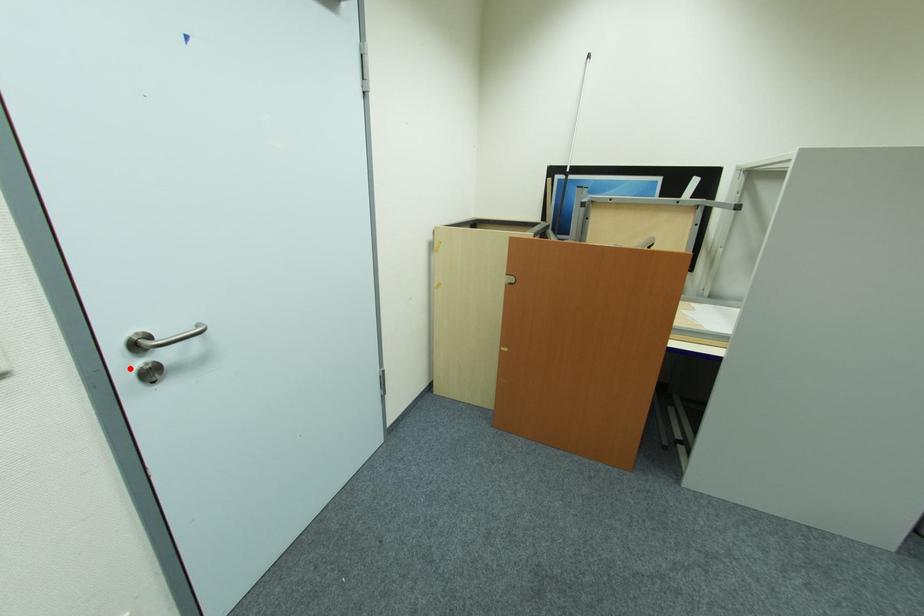
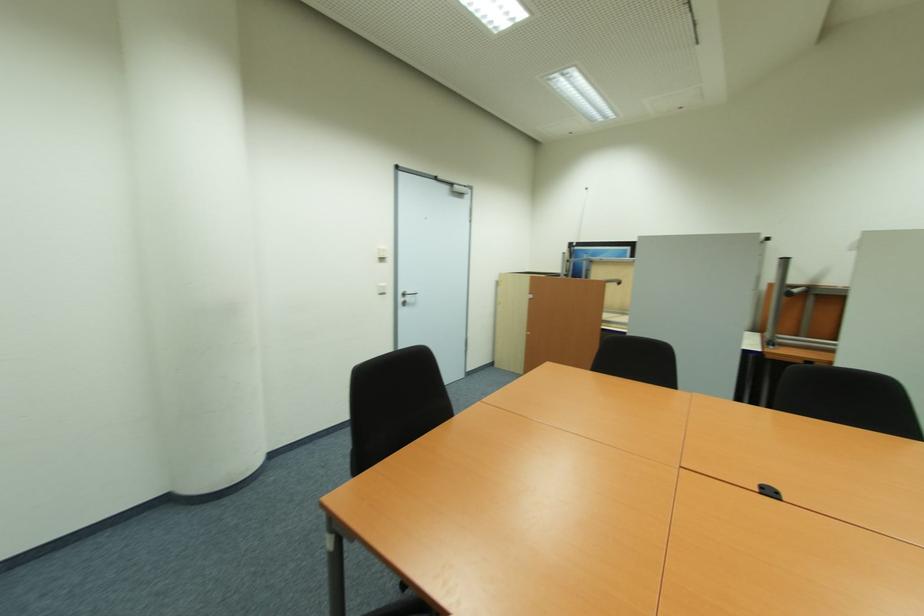
Find the pixel in the second image that matches the highlighted location in the first image.

(405, 300)